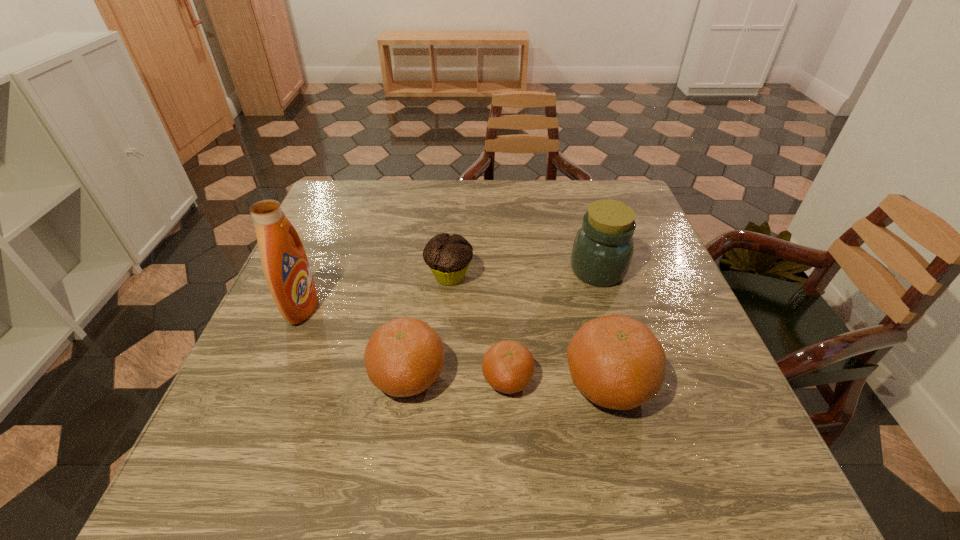
What are the coordinates of `the leftmost clementine` in the screenshot? It's located at (403, 357).

Image resolution: width=960 pixels, height=540 pixels. I want to click on the third object from right to left, so click(x=508, y=366).

Identify the location of the shortest object. (508, 366).

Where is `the rightmost clementine`? This screenshot has width=960, height=540. the rightmost clementine is located at coordinates (615, 361).

The width and height of the screenshot is (960, 540). What are the coordinates of `detergent` in the screenshot? It's located at (285, 265).

In order to click on the leftmost object in this screenshot , I will do `click(285, 265)`.

Locate an element on the screen. The height and width of the screenshot is (540, 960). muffin is located at coordinates (448, 257).

You are a GUI agent. You are given a task and a screenshot of the screen. Output one action in this format:
    pyautogui.click(x=<x>, y=<y>)
    Task: Click on the second tallest object
    This screenshot has height=540, width=960.
    Given the screenshot: What is the action you would take?
    pyautogui.click(x=602, y=251)

Locate an element on the screen. blank space located on the back of the leftmost clementine is located at coordinates (428, 232).

The width and height of the screenshot is (960, 540). What are the coordinates of `vacant space located 0.140m on the back of the second clementine from left to right` in the screenshot? It's located at (504, 309).